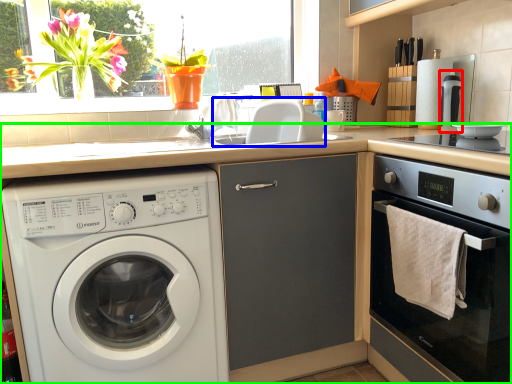
Question: Considering the real-world distances, which object is closest to coffee machine (highlighted by a red box)? sink (highlighted by a blue box) or countertop (highlighted by a green box).

Choices:
 (A) sink
 (B) countertop

Answer: (A)